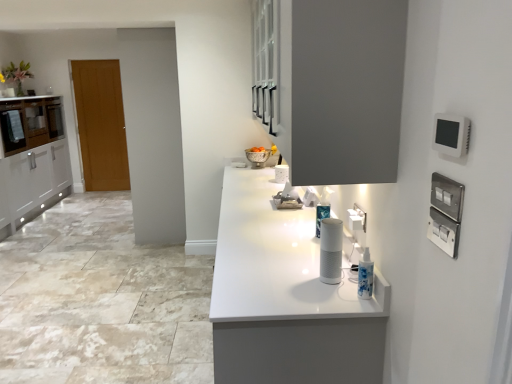
Question: Which direction should I rotate to look at matte gray cabinet at upper center, arranged as the first cabinetry when viewed from the front?

Choices:
 (A) left
 (B) right

Answer: (B)

Question: Does silver metallic bowl at center lie behind white plastic electric outlet at right?

Choices:
 (A) yes
 (B) no

Answer: (A)

Question: Can we say silver metallic bowl at center lies outside white plastic electric outlet at right?

Choices:
 (A) no
 (B) yes

Answer: (B)

Question: From a real-world perspective, is silver metallic bowl at center over white plastic electric outlet at right?

Choices:
 (A) yes
 (B) no

Answer: (B)

Question: Would you say silver metallic bowl at center is a long distance from white plastic electric outlet at right?

Choices:
 (A) yes
 (B) no

Answer: (A)

Question: Does silver metallic bowl at center have a lesser height compared to white plastic electric outlet at right?

Choices:
 (A) yes
 (B) no

Answer: (B)

Question: From the image's perspective, is silver metallic bowl at center above white plastic electric outlet at right?

Choices:
 (A) yes
 (B) no

Answer: (A)

Question: Is matte white cabinet at left, marked as the second cabinetry in a right-to-left arrangement, at the left side of wooden door at left?

Choices:
 (A) no
 (B) yes

Answer: (B)

Question: From the image's perspective, is matte white cabinet at left, which ranks as the first cabinetry in back-to-front order, on wooden door at left?

Choices:
 (A) no
 (B) yes

Answer: (A)

Question: Considering the relative sizes of matte white cabinet at left, marked as the second cabinetry in a right-to-left arrangement, and wooden door at left in the image provided, is matte white cabinet at left, marked as the second cabinetry in a right-to-left arrangement, thinner than wooden door at left?

Choices:
 (A) yes
 (B) no

Answer: (B)

Question: Is matte white cabinet at left, which is the second cabinetry in front-to-back order, closer to the viewer compared to wooden door at left?

Choices:
 (A) yes
 (B) no

Answer: (A)

Question: Does matte white cabinet at left, marked as the second cabinetry in a right-to-left arrangement, touch wooden door at left?

Choices:
 (A) no
 (B) yes

Answer: (A)

Question: From a real-world perspective, does matte white cabinet at left, which ranks as the 1th cabinetry in left-to-right order, stand above wooden door at left?

Choices:
 (A) no
 (B) yes

Answer: (B)

Question: Are silver metallic bowl at center and wooden door at left located far from each other?

Choices:
 (A) no
 (B) yes

Answer: (B)